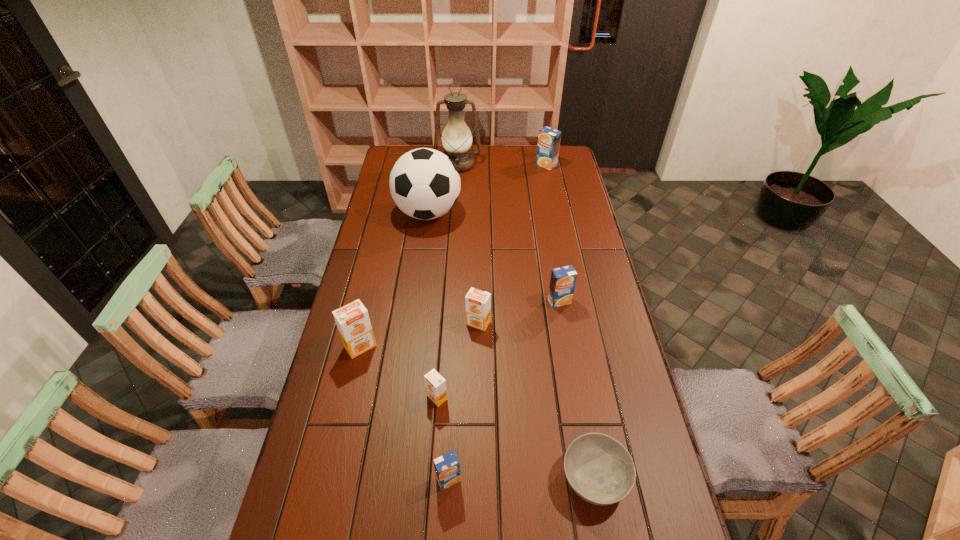
Locate an element on the screen. The height and width of the screenshot is (540, 960). object present at the far right corner is located at coordinates [549, 139].

This screenshot has height=540, width=960. In order to click on vacant space at the far edge of the desktop in this screenshot , I will do `click(529, 147)`.

This screenshot has width=960, height=540. Find the location of `vacant space at the left edge`. vacant space at the left edge is located at coordinates (395, 231).

In the image, there is a desktop. Identify the location of vacant space at the right edge. (629, 511).

This screenshot has width=960, height=540. I want to click on vacant area at the far right corner, so click(x=562, y=154).

Identify the location of vacant area that lies between the third nearest object and the second farthest orange juice. This screenshot has height=540, width=960. (498, 349).

You are a GUI agent. You are given a task and a screenshot of the screen. Output one action in this format:
    pyautogui.click(x=<x>, y=<y>)
    Task: Click on the vacant point located between the smallest orange orange juice and the rightmost orange orange juice
    The width and height of the screenshot is (960, 540).
    Given the screenshot: What is the action you would take?
    pyautogui.click(x=458, y=360)

I want to click on empty location between the third farthest object and the farthest orange juice, so click(x=487, y=189).

The width and height of the screenshot is (960, 540). In order to click on free space between the third farthest object and the fourth nearest orange juice in this screenshot , I will do `click(453, 268)`.

Where is `vacant space in between the second orange orange juice from left to right and the third farthest orange juice`? The width and height of the screenshot is (960, 540). vacant space in between the second orange orange juice from left to right and the third farthest orange juice is located at coordinates (458, 360).